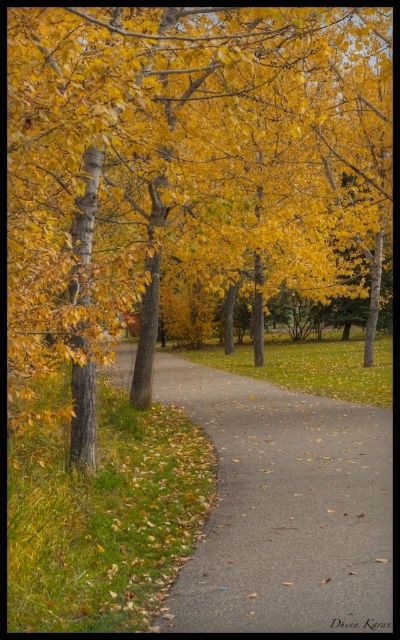
Question: Is golden yellow leaves at center bigger than brown asphalt path at left?

Choices:
 (A) no
 (B) yes

Answer: (B)

Question: Is golden yellow leaves at center wider than brown asphalt path at left?

Choices:
 (A) no
 (B) yes

Answer: (B)

Question: Which object appears farthest from the camera in this image?

Choices:
 (A) brown asphalt path at left
 (B) golden yellow leaves at center

Answer: (B)

Question: Is golden yellow leaves at center smaller than brown asphalt path at left?

Choices:
 (A) yes
 (B) no

Answer: (B)

Question: Which object is closer to the camera taking this photo?

Choices:
 (A) golden yellow leaves at center
 (B) brown asphalt path at left

Answer: (B)